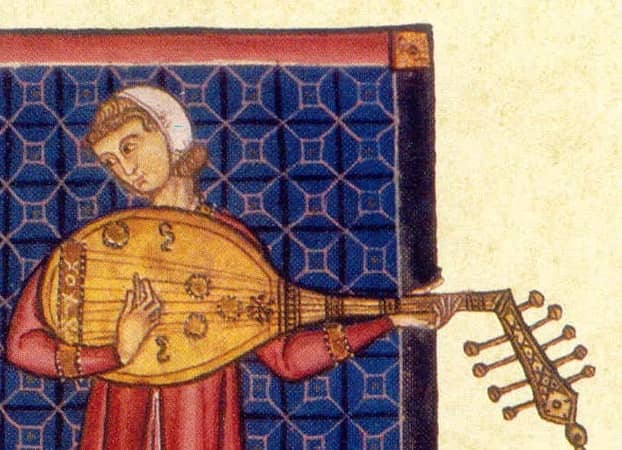
Where is `robe`? This screenshot has width=622, height=450. robe is located at coordinates (214, 399), (124, 401).